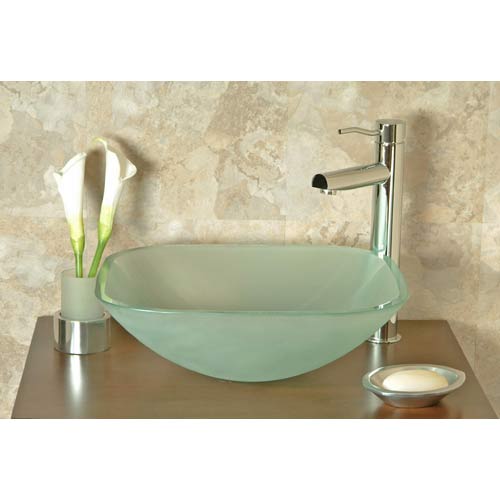
Where is `plant`? This screenshot has height=500, width=500. plant is located at coordinates (67, 226).